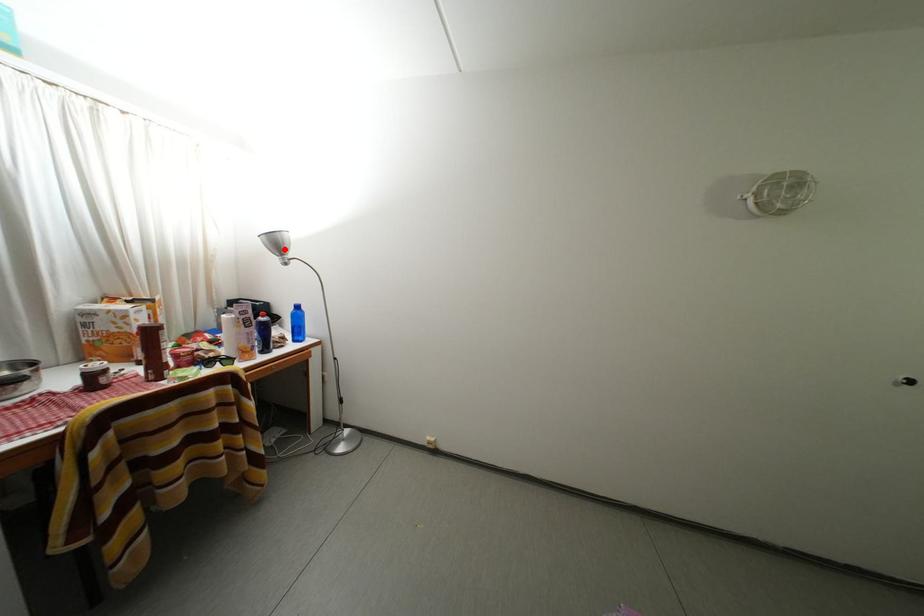
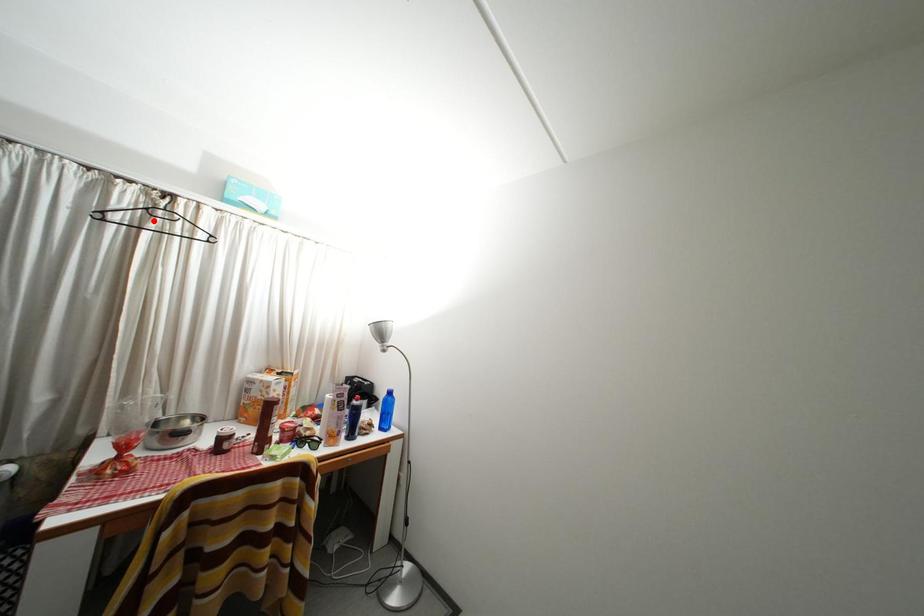
I am providing you with two images of the same scene from different viewpoints. A red point is marked on the first image and another point is marked on the second image. Is the marked point in image1 the same physical position as the marked point in image2?

No